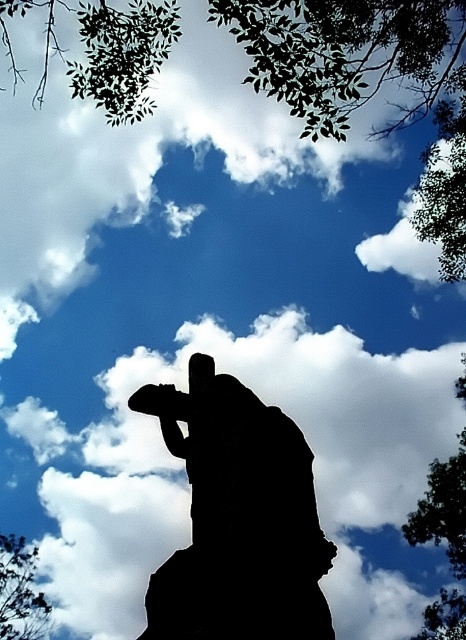
Which of these two, black silhouette skateboarder at center or green leafy tree at upper left, stands taller?

black silhouette skateboarder at center is taller.

Image resolution: width=466 pixels, height=640 pixels. What do you see at coordinates (238, 516) in the screenshot?
I see `black silhouette skateboarder at center` at bounding box center [238, 516].

Find the location of a particular element. This screenshot has width=466, height=640. black silhouette skateboarder at center is located at coordinates (238, 516).